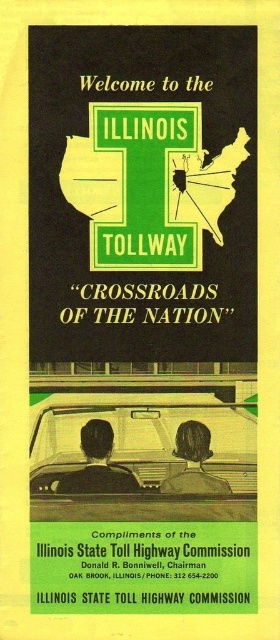
Question: Can you confirm if green matte sign at upper center is wider than matte black car at center?

Choices:
 (A) yes
 (B) no

Answer: (A)

Question: Which point appears closest to the camera in this image?

Choices:
 (A) (71, 273)
 (B) (152, 403)

Answer: (B)

Question: Is green matte sign at upper center above matte black car at center?

Choices:
 (A) yes
 (B) no

Answer: (A)

Question: Can you confirm if green matte sign at upper center is positioned below matte black car at center?

Choices:
 (A) yes
 (B) no

Answer: (B)

Question: Which point is farther to the camera?

Choices:
 (A) (152, 484)
 (B) (29, 332)

Answer: (B)